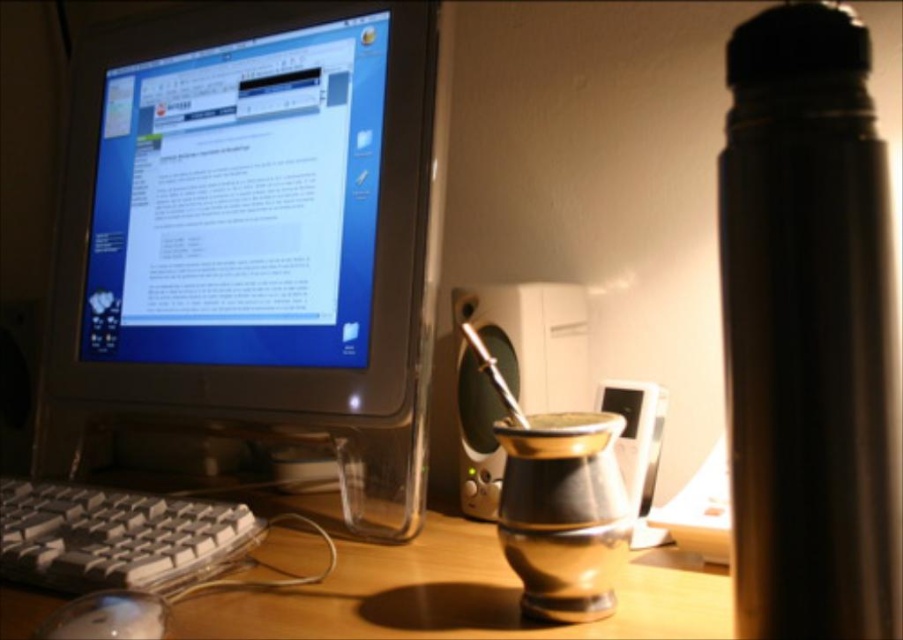
Based on the coordinates provided, which object is located at point (247, 209)?

The matte plastic monitor at upper left is located at point (247, 209).

You are setting up a new desk arrangement and want to place a decorative item between the matte plastic monitor at upper left and the white plastic keyboard at lower left. Given their sizes, which object should the decorative item be placed closer to?

The decorative item should be placed closer to the white plastic keyboard at lower left because the matte plastic monitor at upper left is larger and might require more space between them.

You are organizing your desk and want to place a new item between the matte plastic monitor at upper left and the white plastic mouse at lower left. Considering their sizes, which object is taller and should be placed first to ensure proper spacing?

The matte plastic monitor at upper left is taller than the white plastic mouse at lower left, so it should be placed first to ensure proper spacing.